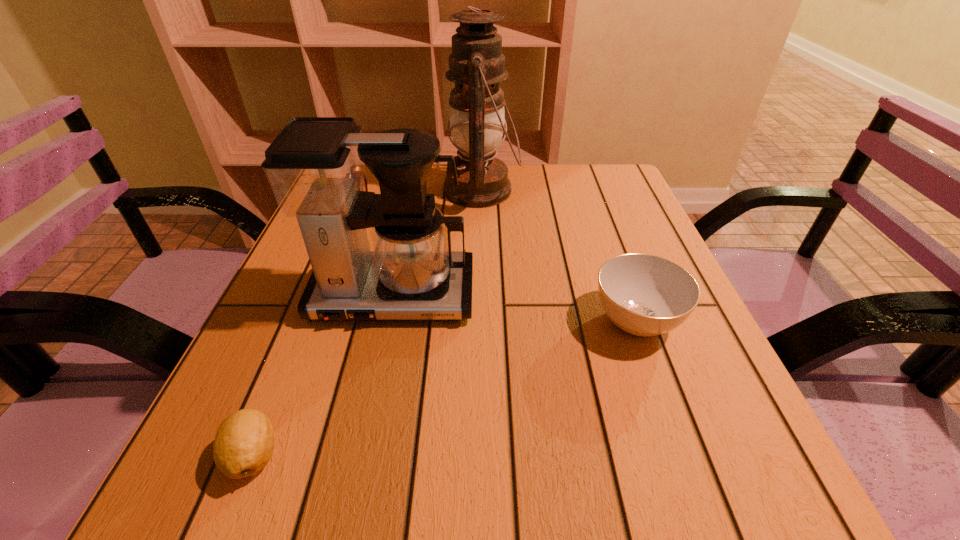
Identify the location of lantern. (476, 65).

Where is `the fourth shortest object`? the fourth shortest object is located at coordinates (316, 166).

The height and width of the screenshot is (540, 960). In order to click on alarm clock in this screenshot , I will do `click(364, 187)`.

Where is `the rightmost object`? the rightmost object is located at coordinates (645, 295).

Find the location of a particular element. chinaware is located at coordinates (645, 295).

Locate an element on the screen. the nearest object is located at coordinates (244, 443).

Where is `the shortest object`? Image resolution: width=960 pixels, height=540 pixels. the shortest object is located at coordinates click(244, 443).

Find the location of a particular element. The image size is (960, 540). free space located on the front of the tallest object is located at coordinates (482, 255).

This screenshot has width=960, height=540. I want to click on vacant space located at the front of the fourth shortest object where the controls are located, so click(x=370, y=405).

Locate an element on the screen. The width and height of the screenshot is (960, 540). vacant space located on the front-facing side of the third shortest object is located at coordinates (516, 205).